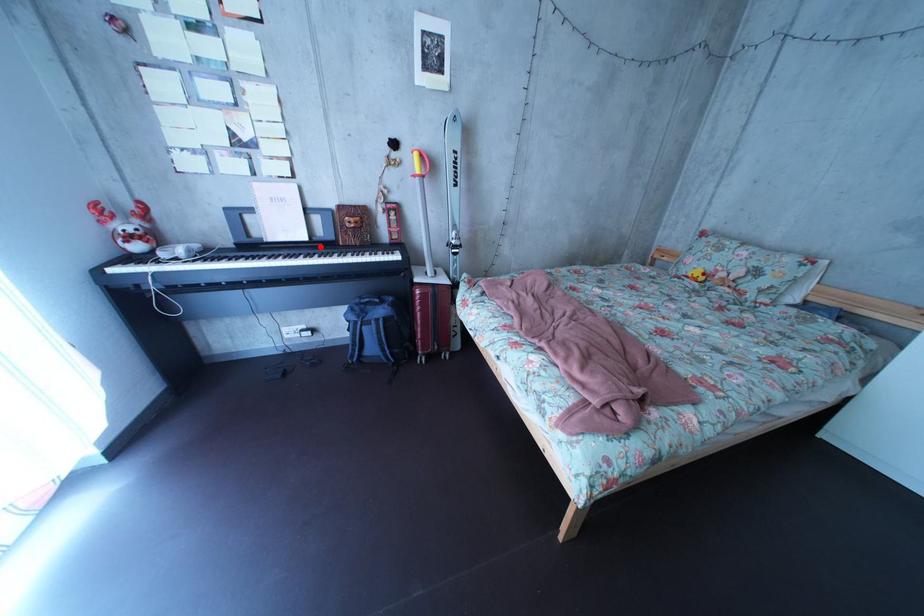
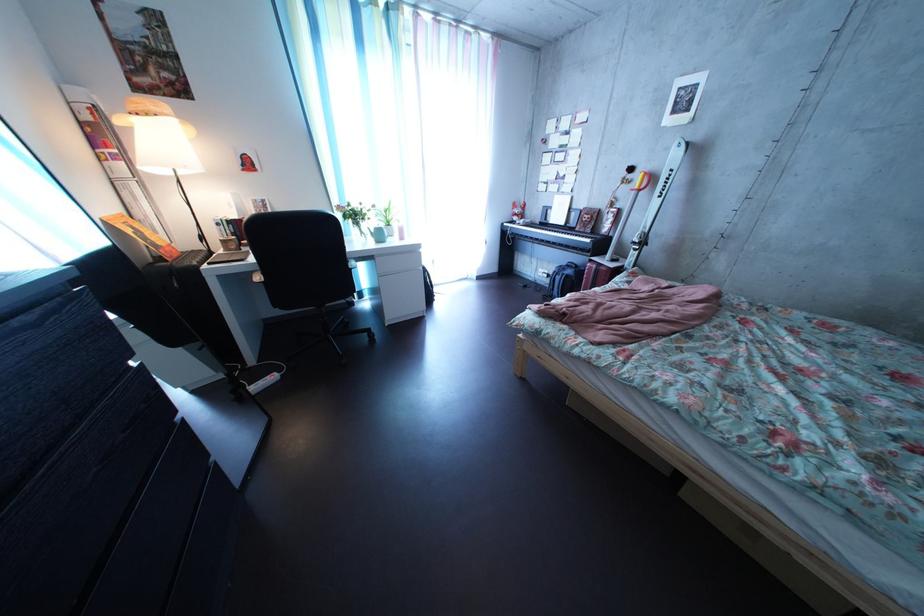
Where in the second image is the point corresponding to the highlighted location from the first image?

(577, 232)